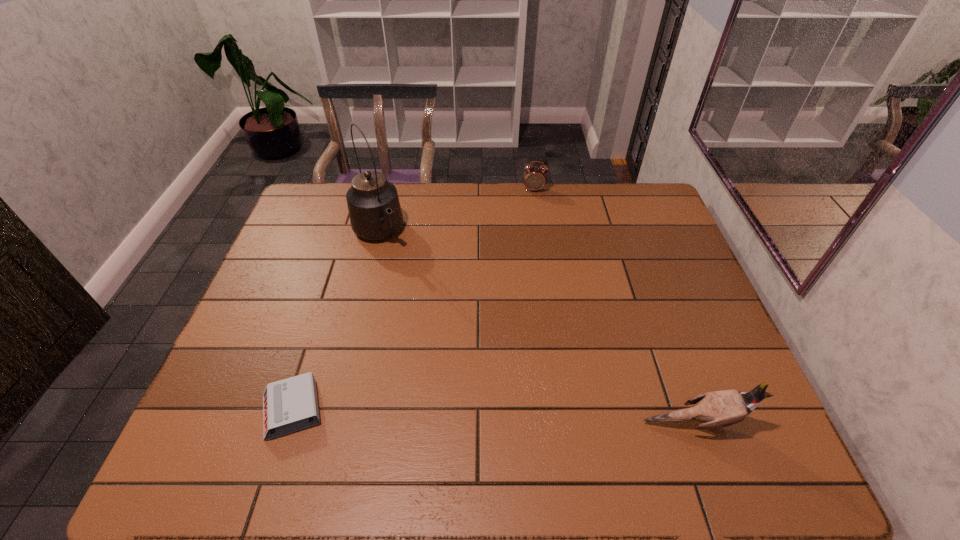
At what (x,y) coordinates should I click in order to perform the action: click on vacant space positioned 0.380m on the face of the taller alarm clock. Please return your answer as a coordinate pair (x, y). The height and width of the screenshot is (540, 960). Looking at the image, I should click on (537, 268).

Identify the location of free location located on the face of the taller alarm clock. pyautogui.click(x=535, y=209).

Image resolution: width=960 pixels, height=540 pixels. Find the location of `vacant space located 0.060m spout on the kettle`. vacant space located 0.060m spout on the kettle is located at coordinates (396, 263).

This screenshot has width=960, height=540. Identify the location of free space located 0.070m spout on the kettle. (396, 265).

At what (x,y) coordinates should I click in order to perform the action: click on blank area located spout on the kettle. Please return your answer as a coordinate pair (x, y). Image resolution: width=960 pixels, height=540 pixels. Looking at the image, I should click on (401, 271).

Where is `alarm clock at the far edge`? This screenshot has width=960, height=540. alarm clock at the far edge is located at coordinates [535, 178].

Identify the location of kettle at the far edge. (375, 213).

At what (x,y) coordinates should I click in order to perform the action: click on alarm clock that is at the near edge. Please return your answer as a coordinate pair (x, y). The height and width of the screenshot is (540, 960). Looking at the image, I should click on (289, 405).

Where is `bird located in the near edge section of the desktop`? bird located in the near edge section of the desktop is located at coordinates (717, 409).

Identify the location of object that is at the left edge. (289, 405).